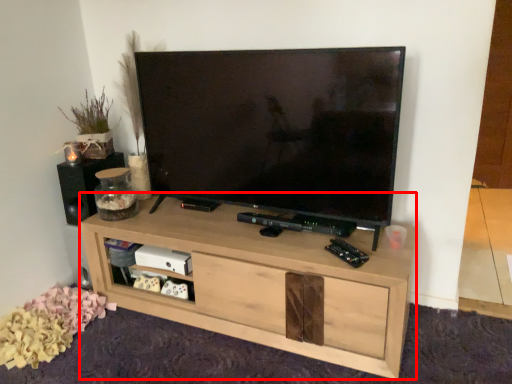
Question: From the image's perspective, what is the correct spatial relationship of shelf (annotated by the red box) in relation to speaker?

Choices:
 (A) above
 (B) below

Answer: (B)